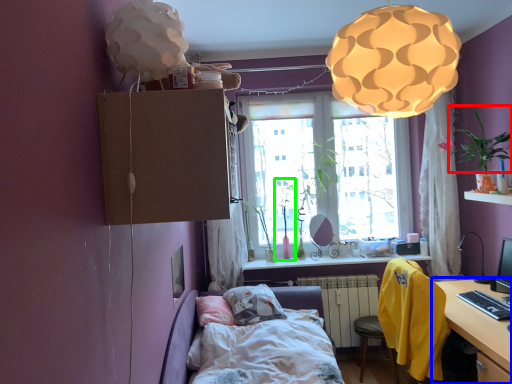
Question: Considering the real-world distances, which object is farthest from plant (highlighted by a red box)? table (highlighted by a blue box) or plant (highlighted by a green box)?

Choices:
 (A) table
 (B) plant

Answer: (B)